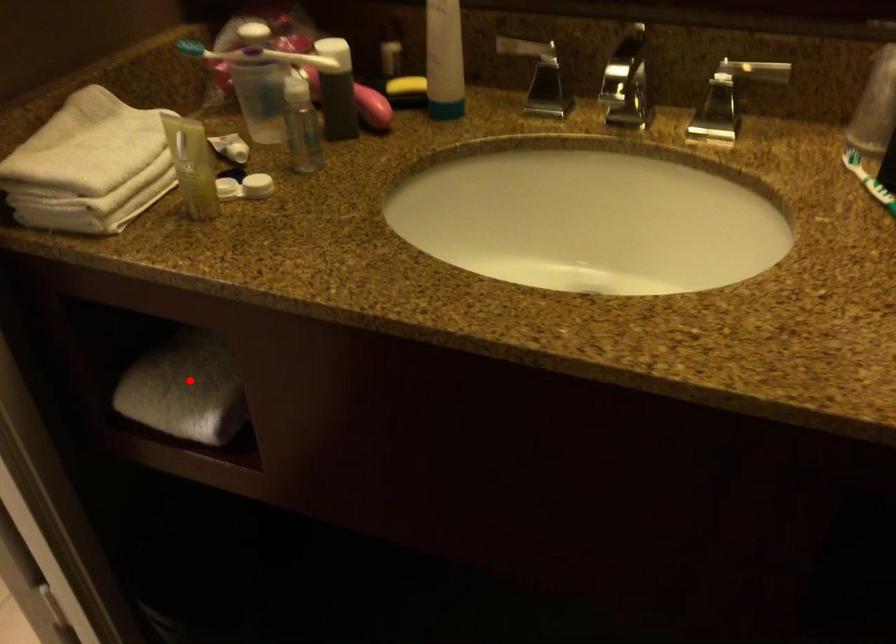
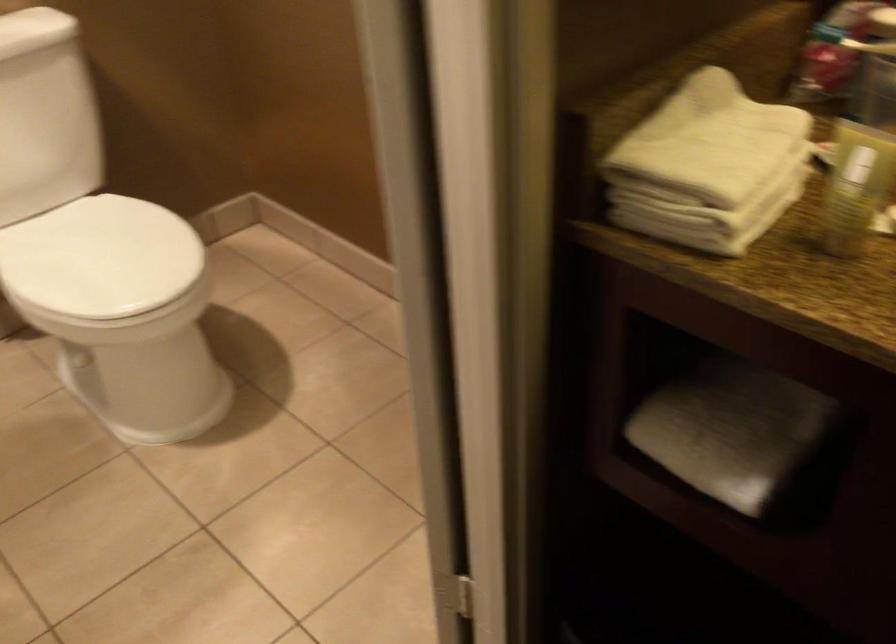
Question: I am providing you with two images of the same scene from different viewpoints. In image1, a red point is highlighted. Considering the same 3D point in image2, which of the following is correct?

Choices:
 (A) It is closer
 (B) It is farther

Answer: (A)